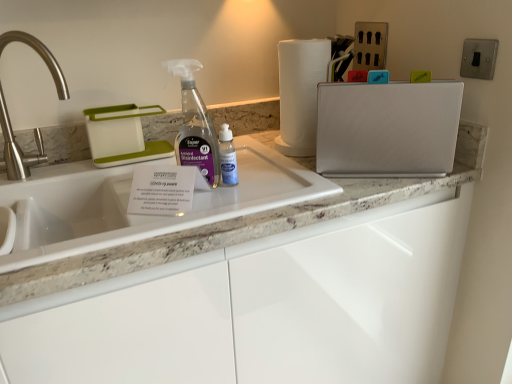
Locate an element on the screen. vacant space in front of white plastic dish rack at upper left, the first appliance viewed from the left is located at coordinates (88, 173).